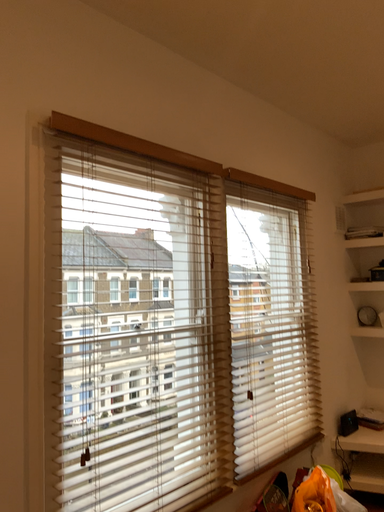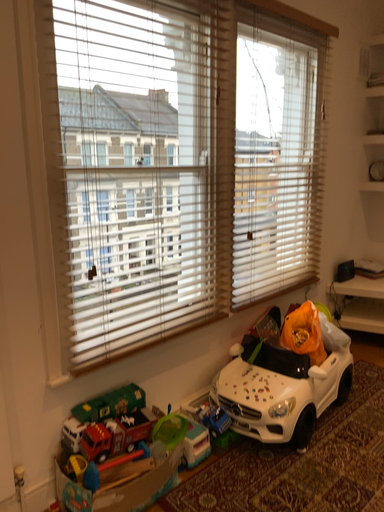
Question: How did the camera likely rotate when shooting the video?

Choices:
 (A) rotated upward
 (B) rotated downward

Answer: (B)